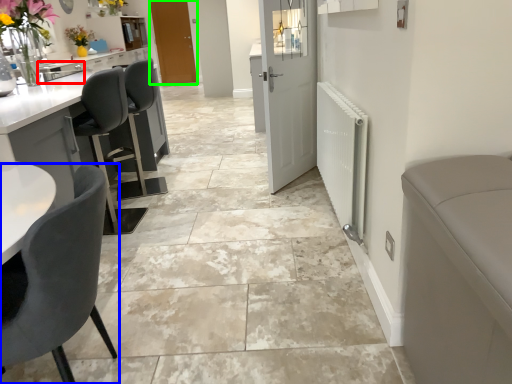
Question: Based on their relative distances, which object is nearer to sink (highlighted by a red box)? Choose from chair (highlighted by a blue box) and door (highlighted by a green box).

Choices:
 (A) chair
 (B) door

Answer: (B)